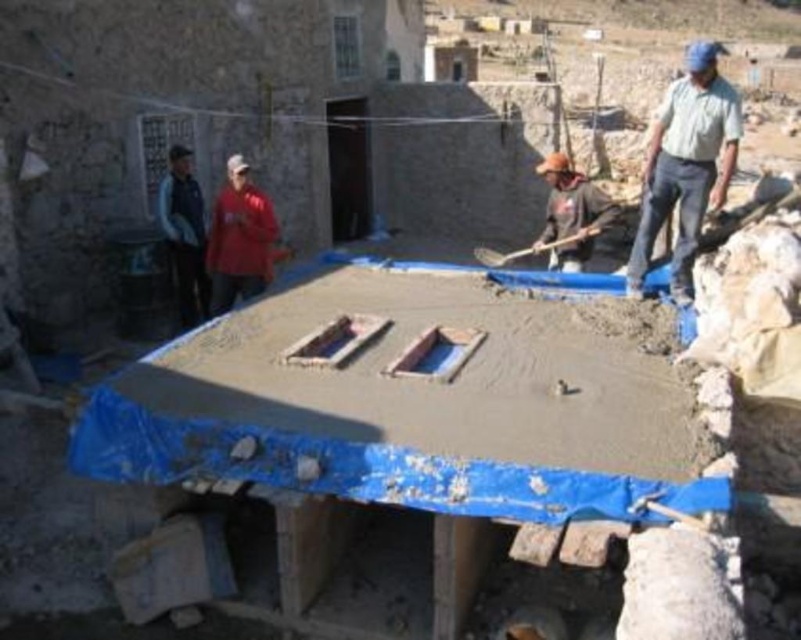
Question: Which of these objects is positioned closest to the light blue shirt at upper right?

Choices:
 (A) wooden shovel at center
 (B) brown fabric at center

Answer: (B)

Question: Is light blue shirt at upper right in front of wooden shovel at center?

Choices:
 (A) yes
 (B) no

Answer: (A)

Question: Among these points, which one is nearest to the camera?

Choices:
 (A) (562, 218)
 (B) (494, 252)
 (C) (737, 122)

Answer: (C)

Question: Considering the real-world distances, which object is farthest from the wooden shovel at center?

Choices:
 (A) brown fabric at center
 (B) light blue shirt at upper right

Answer: (B)

Question: Does light blue shirt at upper right appear on the right side of brown fabric at center?

Choices:
 (A) no
 (B) yes

Answer: (B)

Question: Does light blue shirt at upper right come behind wooden shovel at center?

Choices:
 (A) yes
 (B) no

Answer: (B)